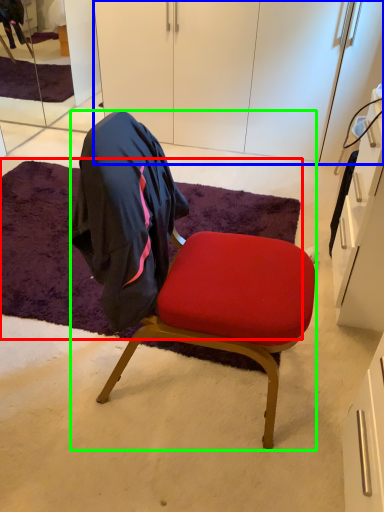
Question: Based on their relative distances, which object is farther from mat (highlighted by a red box)? Choose from cabinetry (highlighted by a blue box) and chair (highlighted by a green box).

Choices:
 (A) cabinetry
 (B) chair

Answer: (A)